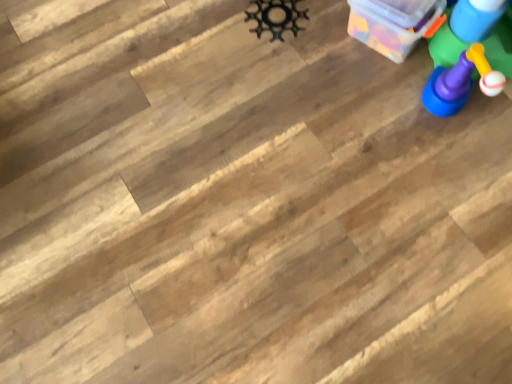
Question: Is matte plastic toy at right, which is the 2th toy in right-to-left order, situated inside black metal gear at upper center, which is counted as the 1th toy, starting from the left, or outside?

Choices:
 (A) outside
 (B) inside

Answer: (A)

Question: From the image's perspective, is matte plastic toy at right, placed as the second toy when sorted from left to right, positioned above or below black metal gear at upper center, which is counted as the 1th toy, starting from the left?

Choices:
 (A) above
 (B) below

Answer: (B)

Question: Considering the real-world distances, which object is farthest from the matte plastic toy at right, placed as the second toy when sorted from left to right?

Choices:
 (A) transparent plastic container at upper right
 (B) blue plastic toy at upper right, the third toy when ordered from left to right
 (C) black metal gear at upper center, which is counted as the 1th toy, starting from the left

Answer: (C)

Question: Which object is the farthest from the black metal gear at upper center, which is counted as the 1th toy, starting from the left?

Choices:
 (A) blue plastic toy at upper right, the third toy when ordered from left to right
 (B) transparent plastic container at upper right
 (C) matte plastic toy at right, which is the 2th toy in right-to-left order

Answer: (A)